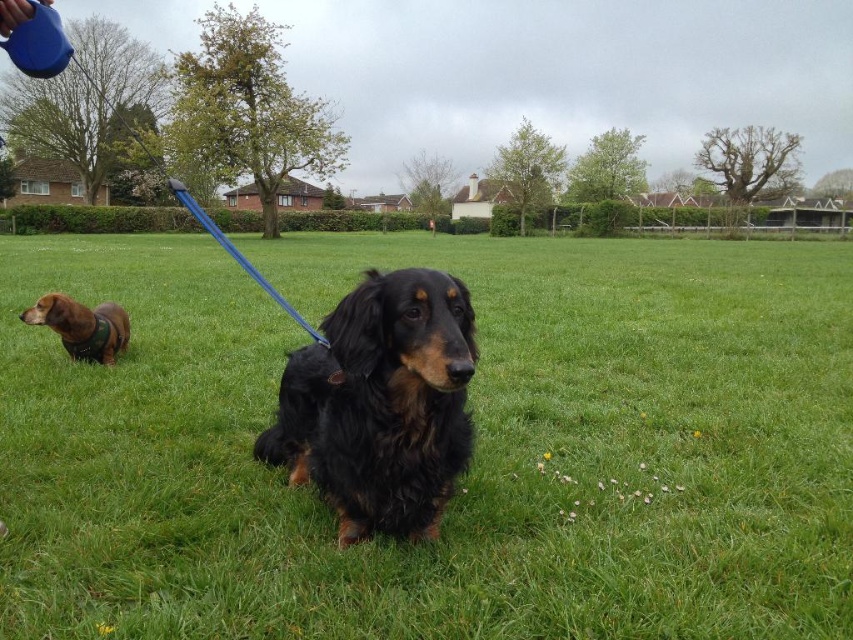
You are standing at the point marked by the coordinates point at (473, 456) in the image. Based on the scene description, what is the color of the ground beneath you?

The point at (473, 456) is described as green grass at center, so the ground beneath you is green.

You are a photographer standing in the park. You want to take a photo of the shiny black fur at center. Where should you position yourself to capture it best?

The shiny black fur at center is located at point 0.633 on the x axis and 0.447 on the y axis, so you should position yourself directly in front of that coordinate to capture it best.

You are a photographer trying to capture both the shiny black fur at center and the brown fur dog at left in a single frame. Based on their positions and sizes, can you fit both subjects into your camera view without moving your position?

The shiny black fur at center might be wider than brown fur dog at left, so there is a possibility that both can fit into the frame if their combined width does not exceed the camera view. However, without exact measurements, it is uncertain.